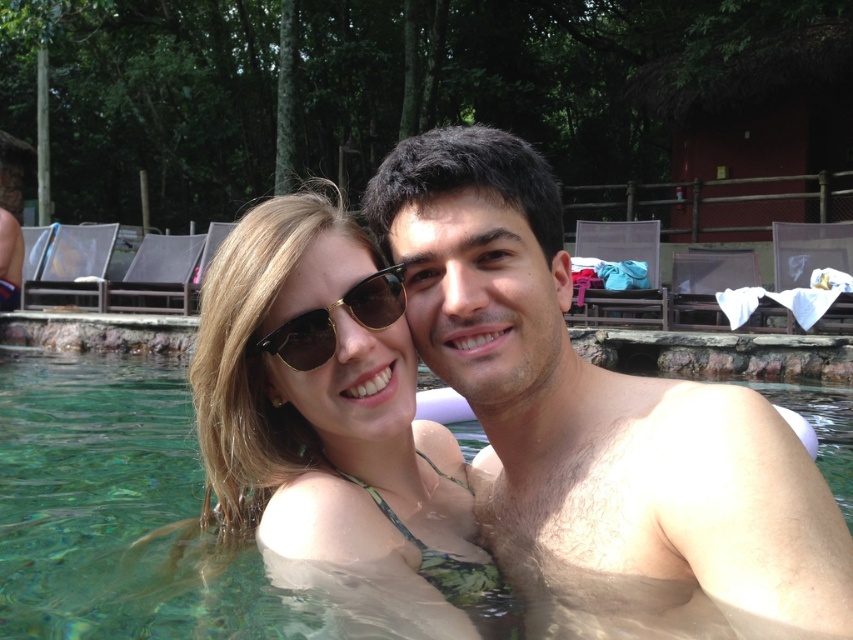
You are a photographer adjusting your camera to focus on two points in the pool scene. The first point is labeled as point (604, 374), and the second is point (705, 400). Which point is closer to your camera lens?

Point (604, 374) is closer to the camera lens because it is further to the camera than point (705, 400).

You are standing at point (225, 244) and want to take a photo of the two people in the pool. The camera you have can focus on subjects within 5 feet. Will the camera be able to capture them clearly?

The distance between point (225, 244) and the camera is 4.92 feet, which is within the camera focus range of 5 feet. Therefore, the camera can capture them clearly.